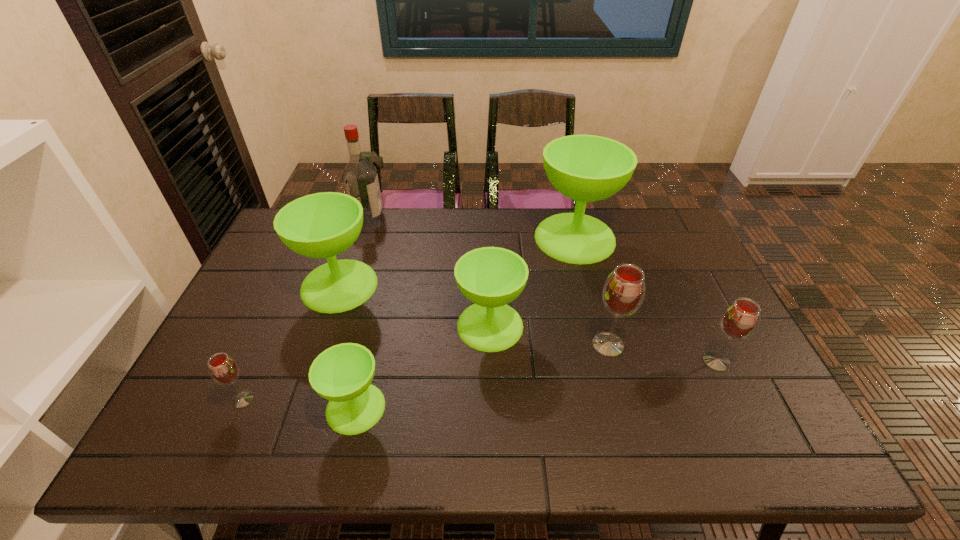
Image resolution: width=960 pixels, height=540 pixels. Find the location of `the smallest red wineglass`. the smallest red wineglass is located at coordinates (223, 369).

Locate an element on the screen. This screenshot has height=540, width=960. the smallest green wineglass is located at coordinates (342, 374).

Image resolution: width=960 pixels, height=540 pixels. In order to click on vacant region located on the front-facing side of the liquor in this screenshot , I will do `click(450, 217)`.

Locate an element on the screen. The width and height of the screenshot is (960, 540). free space located on the left of the tallest wineglass is located at coordinates (422, 238).

The width and height of the screenshot is (960, 540). What are the coordinates of `vacant space located on the back of the second biggest green wineglass` in the screenshot? It's located at (363, 214).

I want to click on vacant space located 0.070m on the right of the biggest red wineglass, so click(x=653, y=345).

Where is `vacant space located 0.060m on the back of the second green wineglass from right to left`? vacant space located 0.060m on the back of the second green wineglass from right to left is located at coordinates click(490, 287).

Where is `vacant space located on the front of the second smallest red wineglass`? vacant space located on the front of the second smallest red wineglass is located at coordinates (732, 395).

Locate an element on the screen. The height and width of the screenshot is (540, 960). vacant region located 0.180m on the right of the smallest red wineglass is located at coordinates [331, 399].

You are a GUI agent. You are given a task and a screenshot of the screen. Output one action in this format:
    pyautogui.click(x=<x>, y=<y>)
    Task: Click on the vacant space situated 0.070m on the right of the smallest green wineglass
    
    Given the screenshot: What is the action you would take?
    pyautogui.click(x=415, y=408)